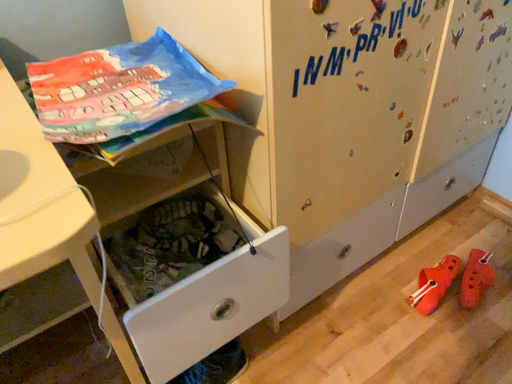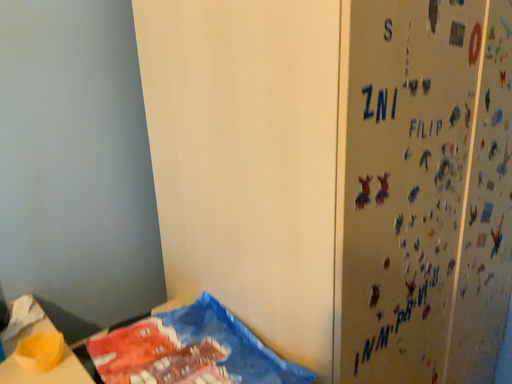
Question: How did the camera likely rotate when shooting the video?

Choices:
 (A) rotated downward
 (B) rotated upward

Answer: (B)